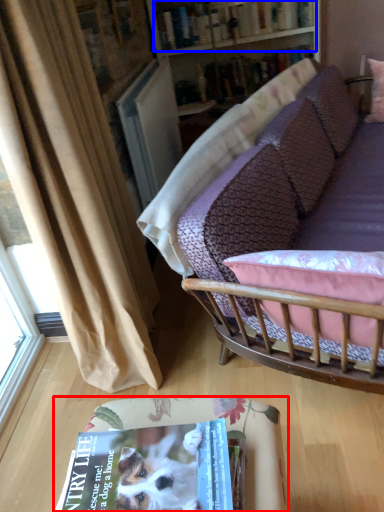
Question: Which object is further to the camera taking this photo, table (highlighted by a red box) or book (highlighted by a blue box)?

Choices:
 (A) table
 (B) book

Answer: (B)